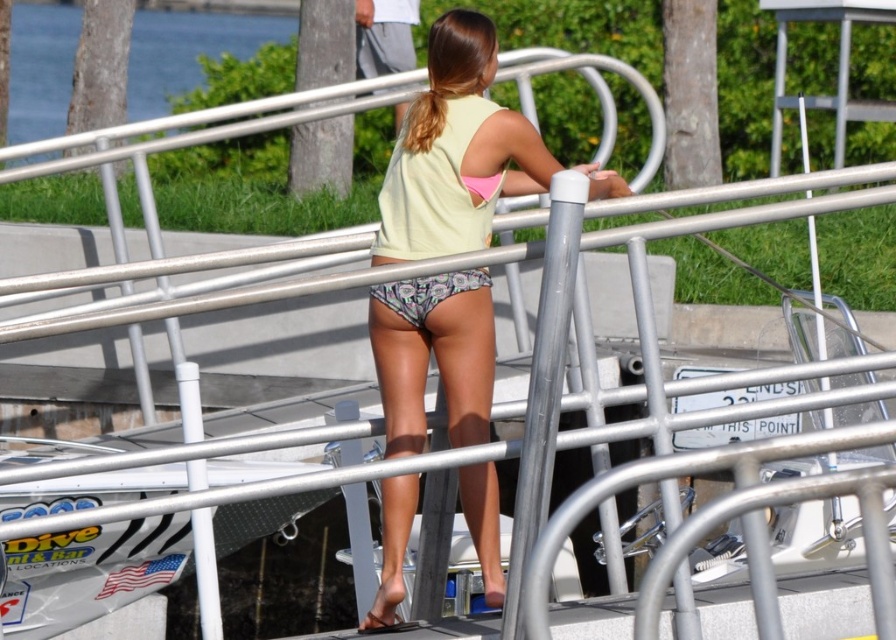
Question: Which point appears closest to the camera in this image?

Choices:
 (A) (388, 228)
 (B) (369, 29)
 (C) (470, 211)

Answer: (C)

Question: Does matte yellow tank top at center have a larger size compared to gray cotton shorts at upper center?

Choices:
 (A) yes
 (B) no

Answer: (A)

Question: Is light yellow fabric bikini top at center to the left of gray cotton shorts at upper center from the viewer's perspective?

Choices:
 (A) yes
 (B) no

Answer: (B)

Question: Which of the following is the farthest from the observer?

Choices:
 (A) printed fabric bikini bottom at center
 (B) light yellow fabric bikini top at center
 (C) matte yellow tank top at center
 (D) gray cotton shorts at upper center

Answer: (D)

Question: Is the position of matte yellow tank top at center less distant than that of gray cotton shorts at upper center?

Choices:
 (A) no
 (B) yes

Answer: (B)

Question: Which is farther from the printed fabric bikini bottom at center?

Choices:
 (A) gray cotton shorts at upper center
 (B) light yellow fabric bikini top at center

Answer: (A)